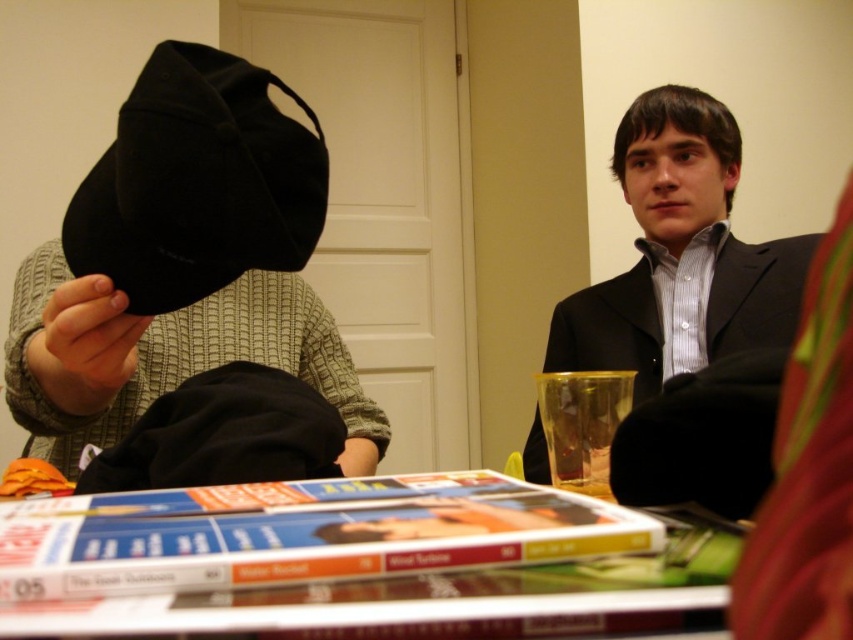
You are a guest at this table and want to grab the translucent plastic cup at lower center without touching the matte black cap at left. Is there enough space between them for you to reach the cup?

The matte black cap at left is to the left of the translucent plastic cup at lower center, so there is space between them. You can reach the cup without touching the cap.

You are a photographer setting up a shot of the scene described. You want to ensure the matte black cap at left is in focus. Given that your camera can only focus on objects within a 0.3 meter radius of the point you select, would focusing at point (183, 262) ensure the matte black cap at left is in focus?

Yes, focusing at point (183, 262) would ensure the matte black cap at left is in focus since the description specifies that the cap is located exactly at that point.

You are trying to decide which cap to wear for a casual outdoor event. Based on the image, which of the two caps, the matte black cap at left or the black velvet cap at upper left, would be more appropriate if you want something less bulky?

The black velvet cap at upper left is less bulky since it is much shorter than the matte black cap at left.